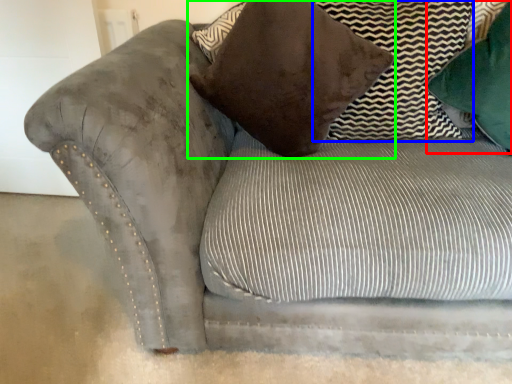
Question: Based on their relative distances, which object is nearer to pillow (highlighted by a red box)? Choose from pillow (highlighted by a blue box) and pillow (highlighted by a green box).

Choices:
 (A) pillow
 (B) pillow

Answer: (A)